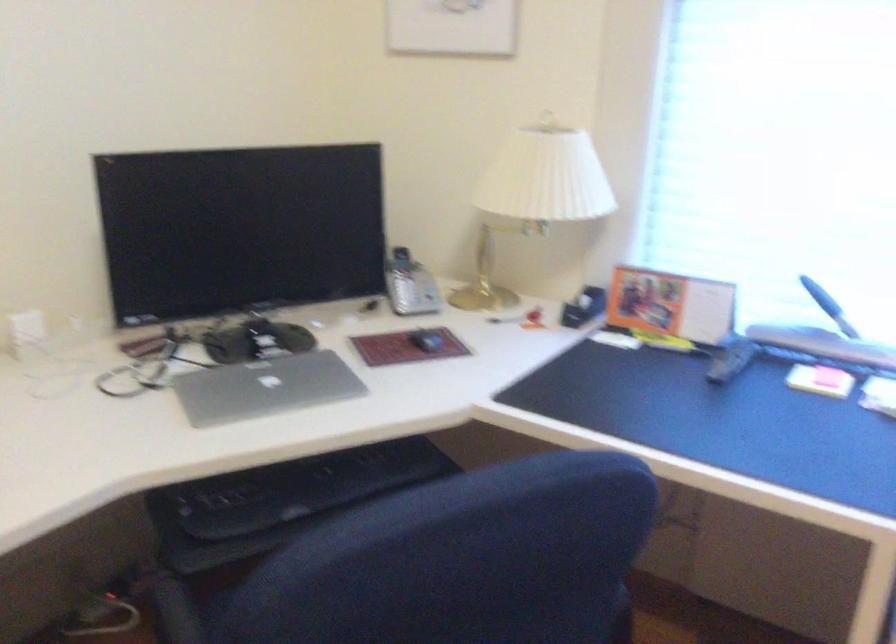
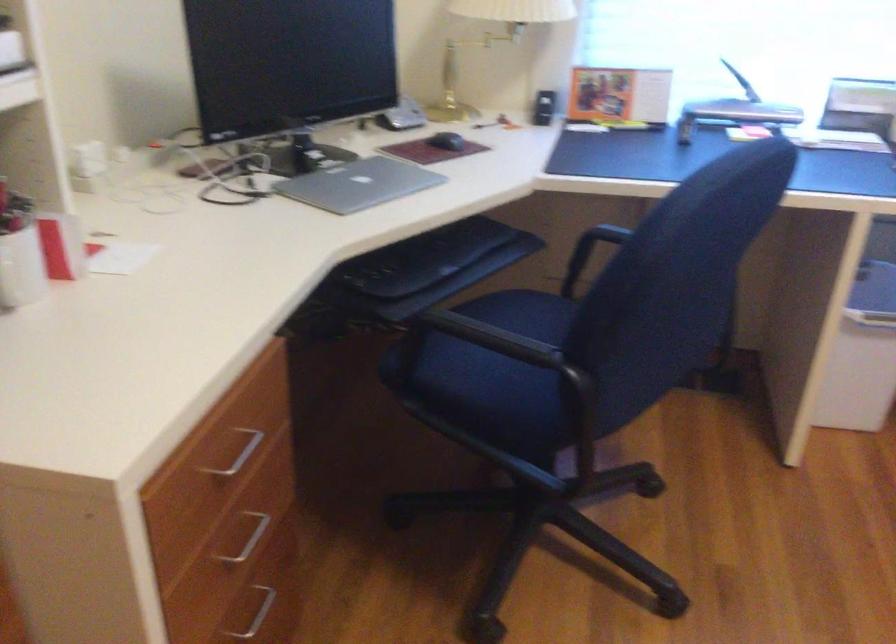
Question: I am providing you with two images of the same scene from different viewpoints. Please identify which objects are invisible in image2.

Choices:
 (A) white pen holder
 (B) yellow dispenser pump
 (C) blue chair armrest
 (D) pink sticky note pad

Answer: (D)